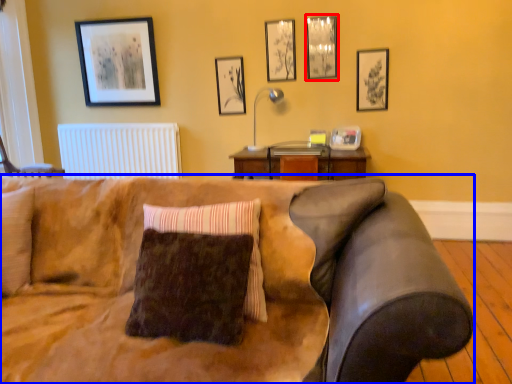
Question: Which object appears farthest to the camera in this image, picture frame (highlighted by a red box) or studio couch (highlighted by a blue box)?

Choices:
 (A) picture frame
 (B) studio couch

Answer: (A)